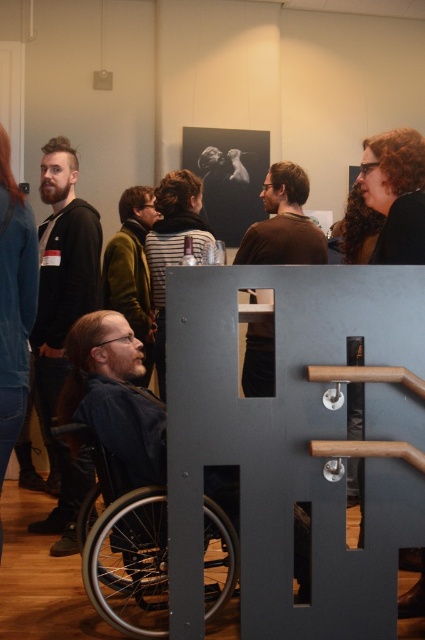
Is dark blue leather wheelchair at center wider than brown matte shirt at center?

Yes.

Is the position of dark blue leather wheelchair at center less distant than that of brown matte shirt at center?

Yes.

The image size is (425, 640). What do you see at coordinates (115, 396) in the screenshot? I see `dark blue leather wheelchair at center` at bounding box center [115, 396].

At what (x,y) coordinates should I click in order to perform the action: click on dark blue leather wheelchair at center. Please return your answer as a coordinate pair (x, y). Looking at the image, I should click on (115, 396).

Who is taller, silver metallic wheelchair at lower left or dark blue leather wheelchair at center?

With more height is dark blue leather wheelchair at center.

Which is below, silver metallic wheelchair at lower left or dark blue leather wheelchair at center?

silver metallic wheelchair at lower left is lower down.

Who is more forward, (88, 548) or (139, 401)?

Point (88, 548)

This screenshot has width=425, height=640. What are the coordinates of `silver metallic wheelchair at lower left` in the screenshot? It's located at (124, 547).

In the scene shown: Which of these two, silver metallic wheelchair at lower left or dark brown hoodie at left, stands taller?

With more height is dark brown hoodie at left.

This screenshot has height=640, width=425. I want to click on silver metallic wheelchair at lower left, so (124, 547).

Which is behind, point (204, 547) or point (59, 342)?

Positioned behind is point (59, 342).

Find the location of a particular element. The height and width of the screenshot is (640, 425). silver metallic wheelchair at lower left is located at coordinates (124, 547).